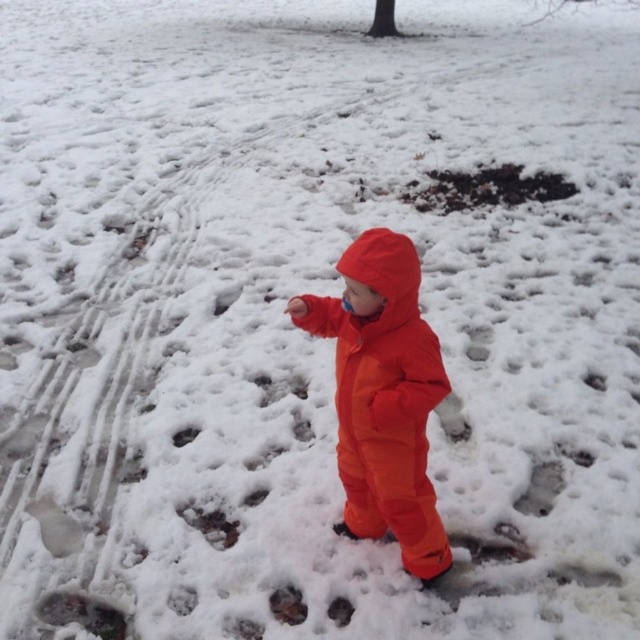
You are a parent looking for your child in a snowy area. You see the orange waterproof snowsuit at center and the brown dirt at center. Which one is lower in the scene?

The orange waterproof snowsuit at center is located below brown dirt at center, so it is lower in the scene.